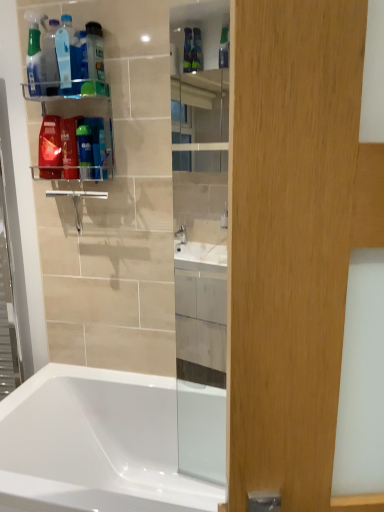
Question: From a real-world perspective, is translucent plastic shaving cream at upper left below white glossy bathtub at lower left?

Choices:
 (A) yes
 (B) no

Answer: (B)

Question: Can you confirm if translucent plastic shaving cream at upper left is thinner than white glossy bathtub at lower left?

Choices:
 (A) yes
 (B) no

Answer: (A)

Question: Is white glossy bathtub at lower left a part of translucent plastic shaving cream at upper left?

Choices:
 (A) yes
 (B) no

Answer: (B)

Question: Does translucent plastic shaving cream at upper left have a greater height compared to white glossy bathtub at lower left?

Choices:
 (A) no
 (B) yes

Answer: (A)

Question: Considering the relative positions of translucent plastic shaving cream at upper left and white glossy bathtub at lower left in the image provided, is translucent plastic shaving cream at upper left to the left of white glossy bathtub at lower left from the viewer's perspective?

Choices:
 (A) yes
 (B) no

Answer: (A)

Question: In the image, is translucent plastic bottle at upper left, the 2th cleaning product when ordered from left to right, on the left side or the right side of translucent plastic shaving cream at upper left?

Choices:
 (A) left
 (B) right

Answer: (A)

Question: In terms of height, does translucent plastic bottle at upper left, the 2th cleaning product when ordered from left to right, look taller or shorter compared to translucent plastic shaving cream at upper left?

Choices:
 (A) tall
 (B) short

Answer: (A)

Question: Is translucent plastic bottle at upper left, the 2th cleaning product when ordered from left to right, inside the boundaries of translucent plastic shaving cream at upper left, or outside?

Choices:
 (A) outside
 (B) inside

Answer: (A)

Question: Considering their positions, is translucent plastic bottle at upper left, the 2th cleaning product when ordered from left to right, located in front of or behind translucent plastic shaving cream at upper left?

Choices:
 (A) behind
 (B) front

Answer: (B)

Question: From a real-world perspective, is translucent plastic spray bottle at upper left, which is the third cleaning product in right-to-left order, physically located above or below clear plastic shelf at upper left?

Choices:
 (A) above
 (B) below

Answer: (A)

Question: Does point (33, 31) appear closer or farther from the camera than point (59, 103)?

Choices:
 (A) farther
 (B) closer

Answer: (B)

Question: Looking at the image, does translucent plastic spray bottle at upper left, which is the third cleaning product in right-to-left order, seem bigger or smaller compared to clear plastic shelf at upper left?

Choices:
 (A) small
 (B) big

Answer: (A)

Question: Is translucent plastic spray bottle at upper left, positioned as the 1th cleaning product in left-to-right order, wider or thinner than clear plastic shelf at upper left?

Choices:
 (A) wide
 (B) thin

Answer: (B)

Question: Looking at the image, does translucent plastic bottle at upper left seem bigger or smaller compared to clear plastic shelf at upper left?

Choices:
 (A) big
 (B) small

Answer: (B)

Question: Considering the positions of translucent plastic bottle at upper left and clear plastic shelf at upper left in the image, is translucent plastic bottle at upper left wider or thinner than clear plastic shelf at upper left?

Choices:
 (A) thin
 (B) wide

Answer: (A)